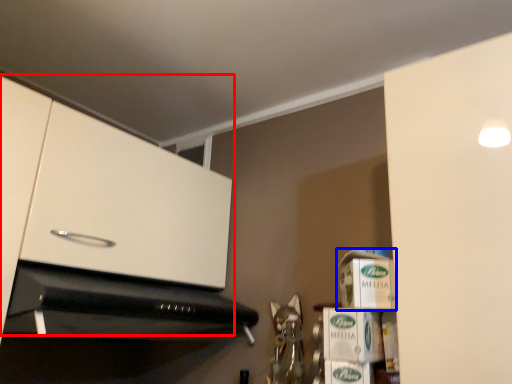
Question: Among these objects, which one is farthest to the camera, cabinetry (highlighted by a red box) or cardboard box (highlighted by a blue box)?

Choices:
 (A) cabinetry
 (B) cardboard box

Answer: (B)